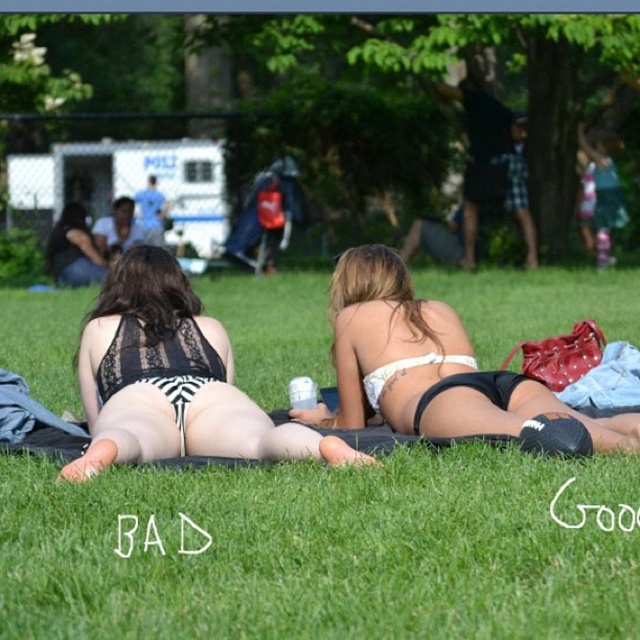
Which is more to the right, green grass at center or black lace bikini at center?

green grass at center

Is point (252, 618) positioned in front of point (93, 326)?

Yes.

You are a GUI agent. You are given a task and a screenshot of the screen. Output one action in this format:
    pyautogui.click(x=<x>, y=<y>)
    Task: Click on the green grass at center
    The image size is (640, 640).
    Given the screenshot: What is the action you would take?
    pyautogui.click(x=323, y=548)

Can you confirm if green grass at center is thinner than white matte bikini top at center?

No, green grass at center is not thinner than white matte bikini top at center.

Does green grass at center have a lesser height compared to white matte bikini top at center?

In fact, green grass at center may be taller than white matte bikini top at center.

Find the location of a particular element. The height and width of the screenshot is (640, 640). green grass at center is located at coordinates (323, 548).

In the scene shown: Which of these two, black lace bikini at center or matte black bikini at center, stands shorter?

black lace bikini at center

Is point (124, 433) behind point (88, 260)?

No, (124, 433) is closer to viewer.

Find the location of a particular element. Image resolution: width=640 pixels, height=640 pixels. black lace bikini at center is located at coordinates (172, 380).